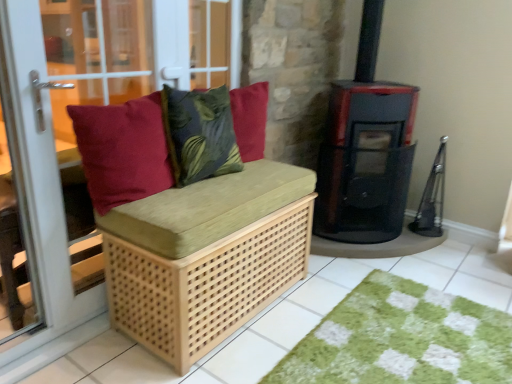
Question: Considering the positions of natural wood bench at left and matte wood bench at left in the image, is natural wood bench at left taller or shorter than matte wood bench at left?

Choices:
 (A) short
 (B) tall

Answer: (A)

Question: Based on their positions, is natural wood bench at left located to the left or right of matte wood bench at left?

Choices:
 (A) left
 (B) right

Answer: (A)

Question: Which is nearer to the matte red cushion at left?

Choices:
 (A) green shaggy rug at lower right
 (B) black glossy wood burning stove at right
 (C) natural wood bench cushion at center
 (D) matte wood bench at left
 (E) velvety green leaf-patterned pillow at center

Answer: (E)

Question: Which of these objects is positioned farthest from the black glossy wood burning stove at right?

Choices:
 (A) natural wood bench at left
 (B) green shaggy rug at lower right
 (C) velvety green leaf-patterned pillow at center
 (D) black matte stove at center right
 (E) matte wood bench at left

Answer: (E)